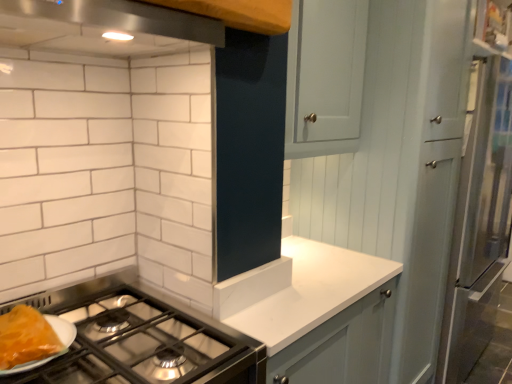
Question: From the image's perspective, is white laminate countertop at center above stainless steel exhaust hood at upper center?

Choices:
 (A) no
 (B) yes

Answer: (A)

Question: Does white laminate countertop at center have a smaller size compared to stainless steel exhaust hood at upper center?

Choices:
 (A) no
 (B) yes

Answer: (A)

Question: Is white laminate countertop at center next to stainless steel exhaust hood at upper center and touching it?

Choices:
 (A) no
 (B) yes

Answer: (A)

Question: Is white laminate countertop at center shorter than stainless steel exhaust hood at upper center?

Choices:
 (A) no
 (B) yes

Answer: (A)

Question: Is the depth of white laminate countertop at center less than that of stainless steel exhaust hood at upper center?

Choices:
 (A) no
 (B) yes

Answer: (A)

Question: Can you confirm if white laminate countertop at center is thinner than stainless steel exhaust hood at upper center?

Choices:
 (A) no
 (B) yes

Answer: (A)

Question: Is white laminate countertop at center a part of stainless steel exhaust hood at upper center?

Choices:
 (A) no
 (B) yes

Answer: (A)

Question: Does stainless steel exhaust hood at upper center lie in front of white laminate countertop at center?

Choices:
 (A) yes
 (B) no

Answer: (A)

Question: Is stainless steel exhaust hood at upper center taller than white laminate countertop at center?

Choices:
 (A) no
 (B) yes

Answer: (A)

Question: From the image's perspective, is stainless steel exhaust hood at upper center on top of white laminate countertop at center?

Choices:
 (A) no
 (B) yes

Answer: (B)

Question: Is stainless steel exhaust hood at upper center wider than white laminate countertop at center?

Choices:
 (A) yes
 (B) no

Answer: (B)

Question: Is stainless steel exhaust hood at upper center aimed at white laminate countertop at center?

Choices:
 (A) yes
 (B) no

Answer: (B)

Question: Can you confirm if stainless steel exhaust hood at upper center is thinner than shiny orange cheese at lower left?

Choices:
 (A) no
 (B) yes

Answer: (A)